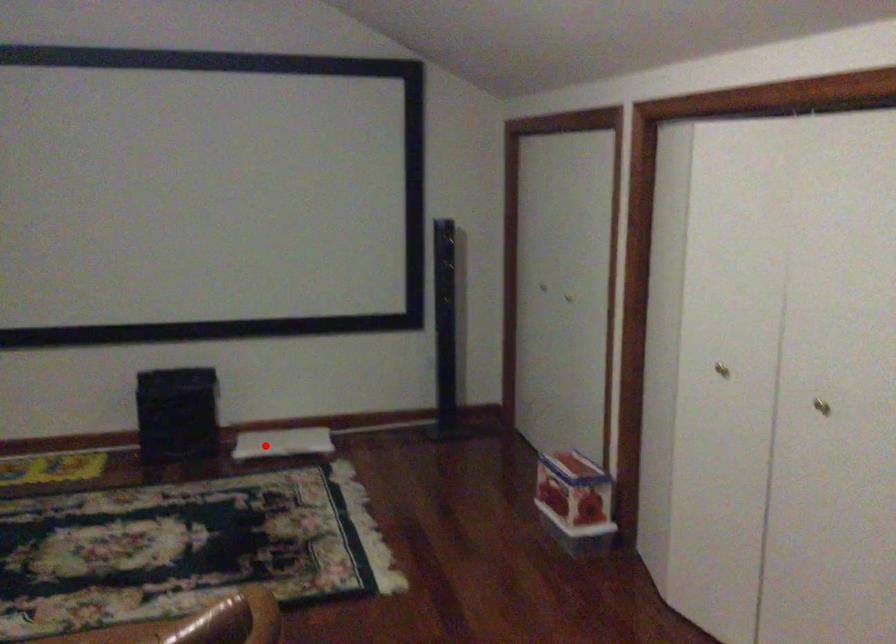
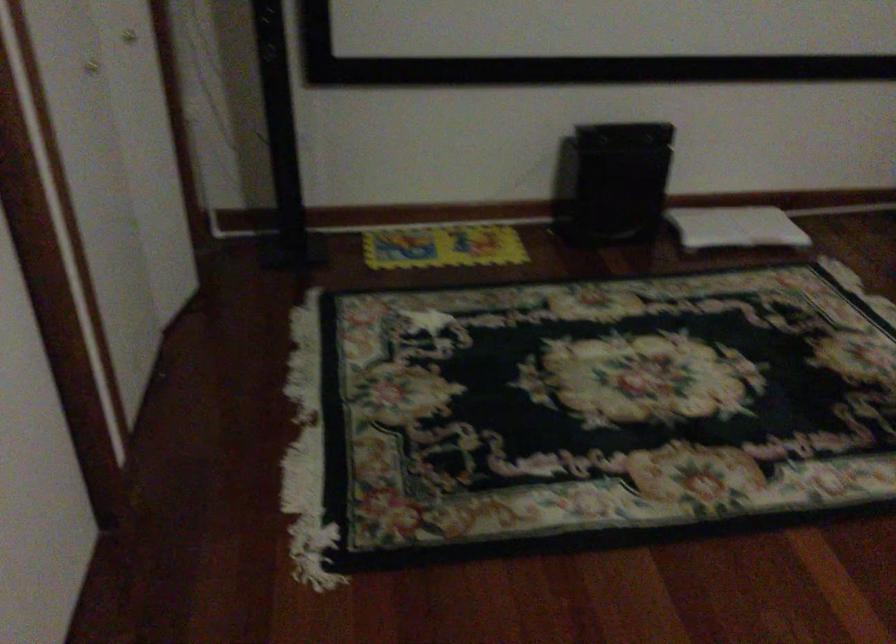
Question: I am providing you with two images of the same scene from different viewpoints. A red point is marked on the first image. Can you still see the location of the red point in image 2?

Choices:
 (A) Yes
 (B) No

Answer: (A)